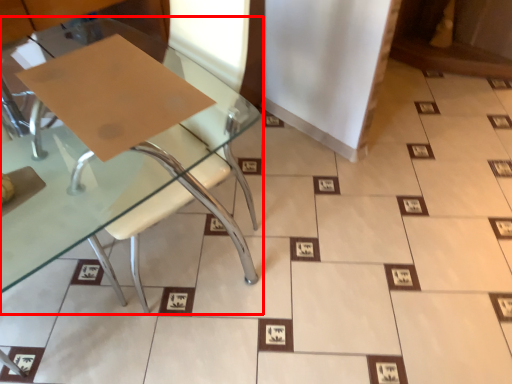
Question: Observing the image, what is the correct spatial positioning of table (annotated by the red box) in reference to cardboard?

Choices:
 (A) left
 (B) right

Answer: (B)